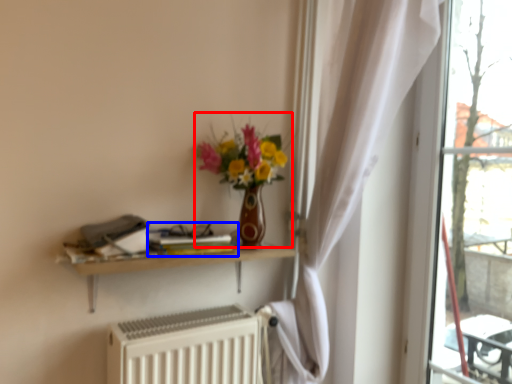
Question: Which object appears farthest to the camera in this image, floral arrangement (highlighted by a red box) or book (highlighted by a blue box)?

Choices:
 (A) floral arrangement
 (B) book

Answer: (B)